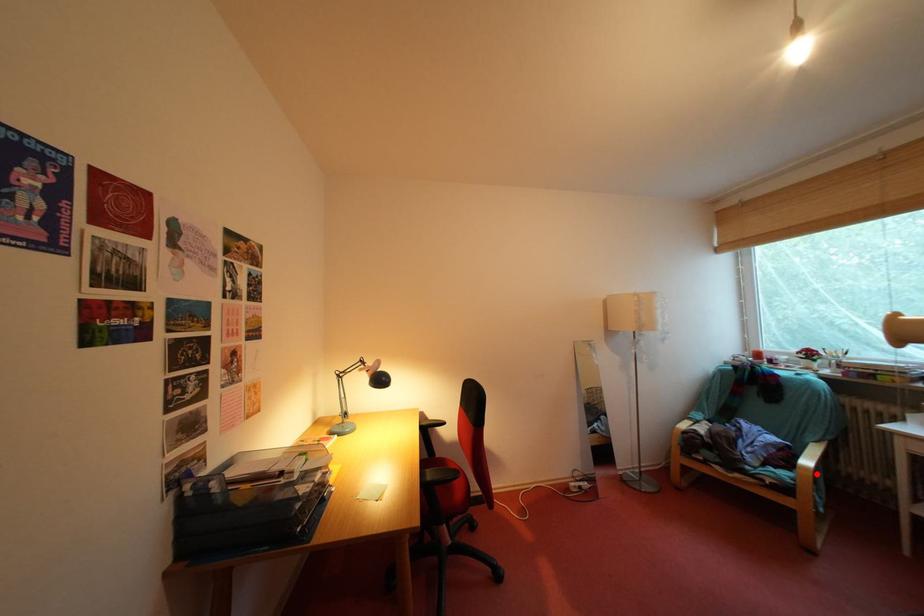
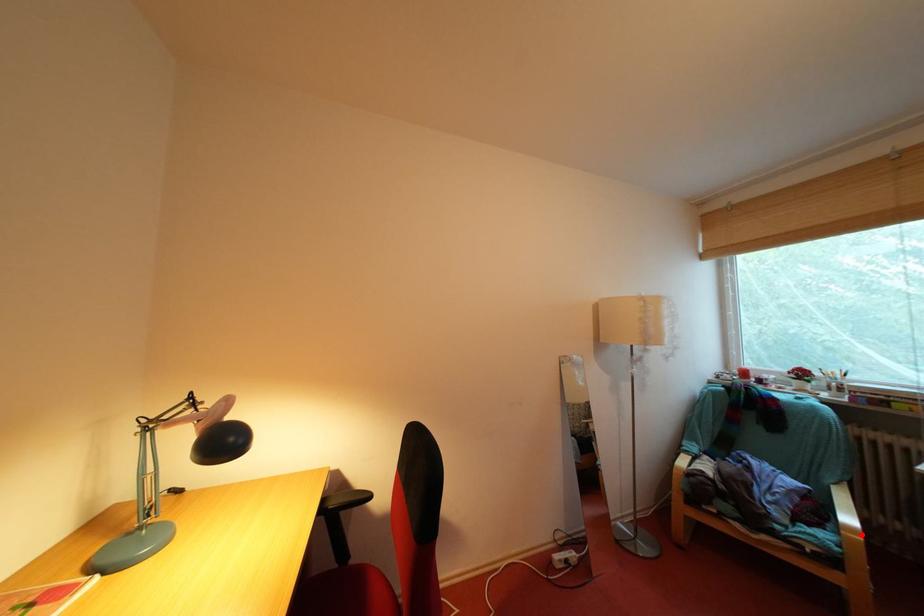
I am providing you with two images of the same scene from different viewpoints. A red point is marked on the first image and another point is marked on the second image. Does the point marked in image1 correspond to the same location as the one in image2?

Yes